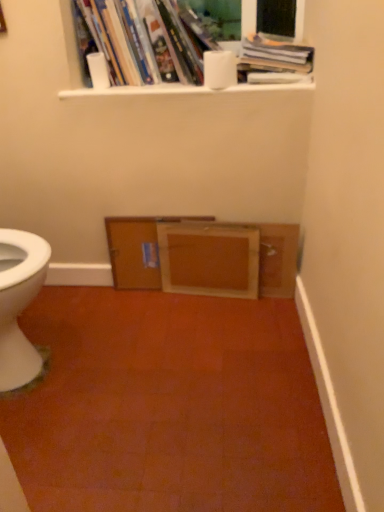
Question: Does white matte toilet paper at upper center, arranged as the second toilet paper when viewed from the left, appear on the right side of hardcover books at upper center, which is counted as the first book, starting from the left?

Choices:
 (A) no
 (B) yes

Answer: (B)

Question: From the image's perspective, is white matte toilet paper at upper center, arranged as the second toilet paper when viewed from the left, under hardcover books at upper center, the 2th book when ordered from right to left?

Choices:
 (A) yes
 (B) no

Answer: (A)

Question: Is white matte toilet paper at upper center, arranged as the second toilet paper when viewed from the left, oriented towards hardcover books at upper center, the 2th book when ordered from right to left?

Choices:
 (A) yes
 (B) no

Answer: (B)

Question: Can you confirm if white matte toilet paper at upper center, which is counted as the first toilet paper, starting from the right, is thinner than hardcover books at upper center, the 2th book when ordered from right to left?

Choices:
 (A) yes
 (B) no

Answer: (A)

Question: Considering the relative sizes of white matte toilet paper at upper center, which is counted as the first toilet paper, starting from the right, and hardcover books at upper center, the 2th book when ordered from right to left, in the image provided, is white matte toilet paper at upper center, which is counted as the first toilet paper, starting from the right, smaller than hardcover books at upper center, the 2th book when ordered from right to left,?

Choices:
 (A) yes
 (B) no

Answer: (A)

Question: Does point (122, 217) appear closer or farther from the camera than point (296, 89)?

Choices:
 (A) closer
 (B) farther

Answer: (B)

Question: Is wooden cabinet at center, the second file cabinet when ordered from right to left, in front of or behind white glossy window sill at upper center in the image?

Choices:
 (A) front
 (B) behind

Answer: (B)

Question: In the image, is wooden cabinet at center, the second file cabinet when ordered from right to left, on the left side or the right side of white glossy window sill at upper center?

Choices:
 (A) right
 (B) left

Answer: (B)

Question: Considering the positions of wooden cabinet at center, the second file cabinet when ordered from right to left, and white glossy window sill at upper center in the image, is wooden cabinet at center, the second file cabinet when ordered from right to left, wider or thinner than white glossy window sill at upper center?

Choices:
 (A) thin
 (B) wide

Answer: (A)

Question: Considering the positions of white matte toilet paper at upper center, the second toilet paper when ordered from right to left, and hardcover book at upper center, which appears as the 2th book when viewed from the left, in the image, is white matte toilet paper at upper center, the second toilet paper when ordered from right to left, wider or thinner than hardcover book at upper center, which appears as the 2th book when viewed from the left,?

Choices:
 (A) wide
 (B) thin

Answer: (B)

Question: Is white matte toilet paper at upper center, the second toilet paper when ordered from right to left, to the left or to the right of hardcover book at upper center, which appears as the 2th book when viewed from the left, in the image?

Choices:
 (A) right
 (B) left

Answer: (B)

Question: Is white matte toilet paper at upper center, the second toilet paper when ordered from right to left, inside or outside of hardcover book at upper center, which appears as the 2th book when viewed from the left?

Choices:
 (A) outside
 (B) inside

Answer: (A)

Question: From a real-world perspective, relative to hardcover book at upper center, which appears as the 2th book when viewed from the left, is white matte toilet paper at upper center, the first toilet paper when ordered from left to right, vertically above or below?

Choices:
 (A) above
 (B) below

Answer: (B)

Question: Looking at their shapes, would you say hardcover books at upper center, which is counted as the first book, starting from the left, is wider or thinner than white matte toilet paper at upper center, the first toilet paper when ordered from left to right?

Choices:
 (A) wide
 (B) thin

Answer: (A)

Question: Considering their positions, is hardcover books at upper center, the 2th book when ordered from right to left, located in front of or behind white matte toilet paper at upper center, the second toilet paper when ordered from right to left?

Choices:
 (A) front
 (B) behind

Answer: (A)